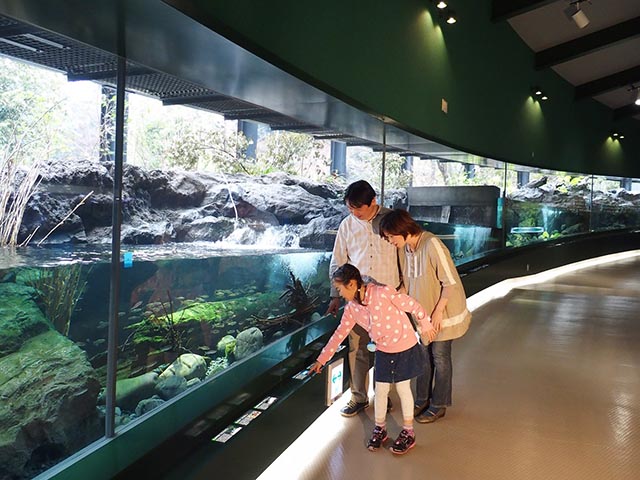
Where is `spotlights`? The width and height of the screenshot is (640, 480). spotlights is located at coordinates (451, 21), (441, 6), (536, 93), (545, 97), (614, 133), (624, 139), (639, 100).